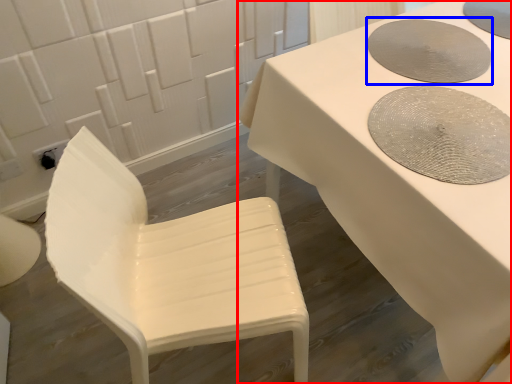
Question: Which object appears farthest to the camera in this image, table (highlighted by a red box) or manhole cover (highlighted by a blue box)?

Choices:
 (A) table
 (B) manhole cover

Answer: (B)